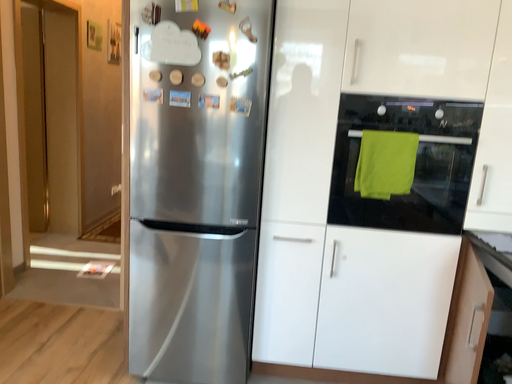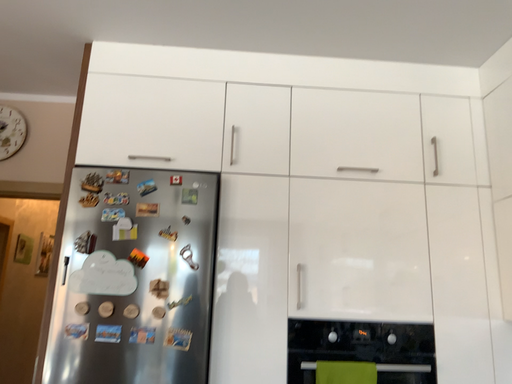
Question: Which way did the camera rotate in the video?

Choices:
 (A) rotated upward
 (B) rotated downward

Answer: (A)